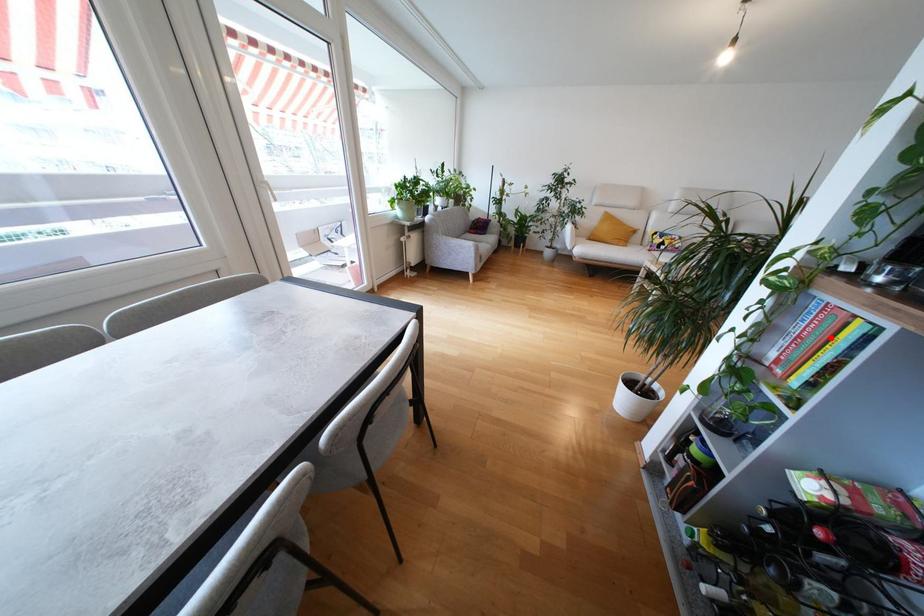
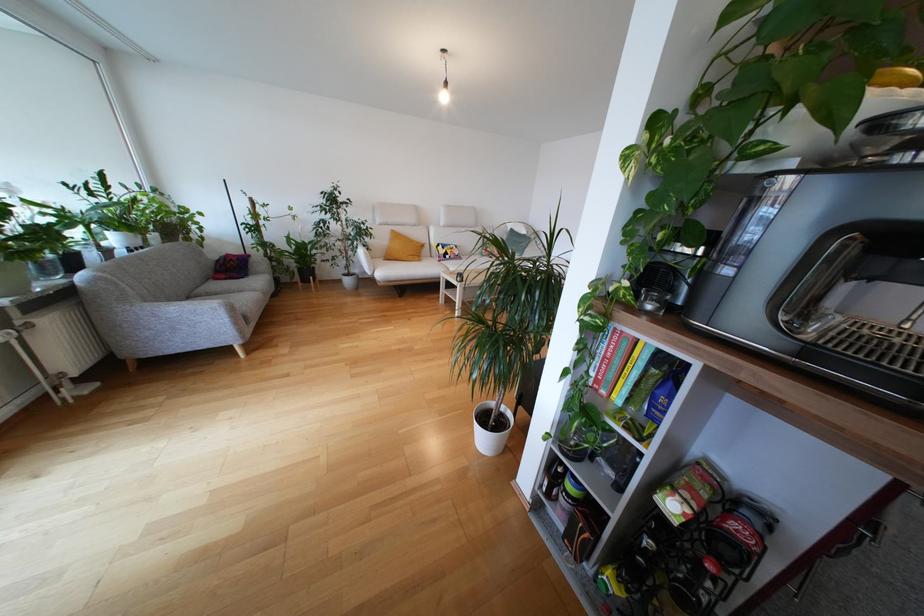
In the second image, find the point that corresponds to the highlighted location in the first image.

(630, 358)